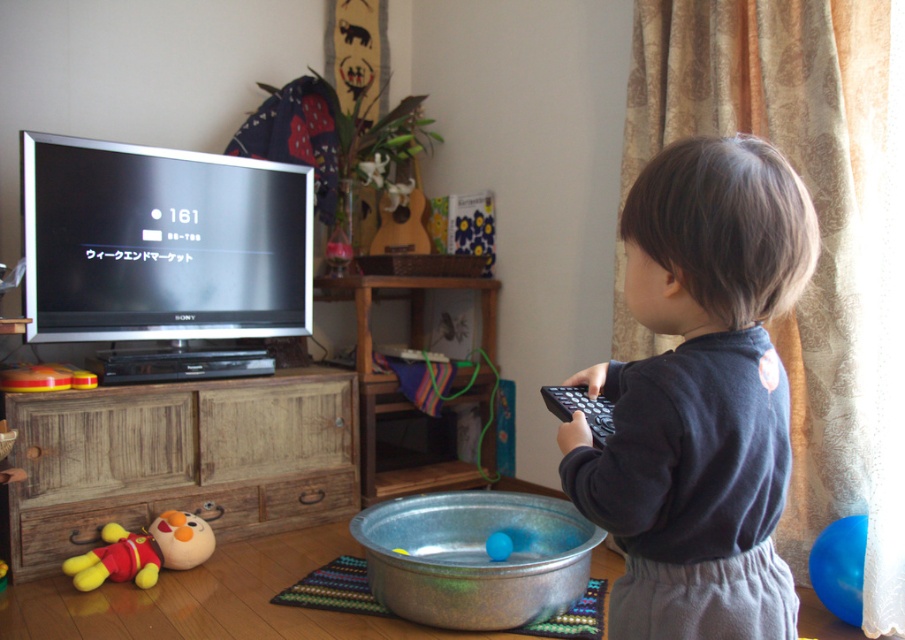
Does wooden cabinet at lower left appear over black matte remote at right?

Actually, wooden cabinet at lower left is below black matte remote at right.

What do you see at coordinates (181, 460) in the screenshot? I see `wooden cabinet at lower left` at bounding box center [181, 460].

The width and height of the screenshot is (905, 640). What are the coordinates of `wooden cabinet at lower left` in the screenshot? It's located at (181, 460).

Looking at this image, is yellow plush toy at lower left smaller than metallic blue bowl at lower center?

Actually, yellow plush toy at lower left might be larger than metallic blue bowl at lower center.

Does yellow plush toy at lower left have a greater width compared to metallic blue bowl at lower center?

Correct, the width of yellow plush toy at lower left exceeds that of metallic blue bowl at lower center.

Identify the location of yellow plush toy at lower left. (143, 552).

Can you confirm if wooden cabinet at lower left is positioned below yellow plush toy at lower left?

Incorrect, wooden cabinet at lower left is not positioned below yellow plush toy at lower left.

Who is positioned more to the left, wooden cabinet at lower left or yellow plush toy at lower left?

yellow plush toy at lower left

What do you see at coordinates (181, 460) in the screenshot? This screenshot has height=640, width=905. I see `wooden cabinet at lower left` at bounding box center [181, 460].

This screenshot has height=640, width=905. Identify the location of wooden cabinet at lower left. (181, 460).